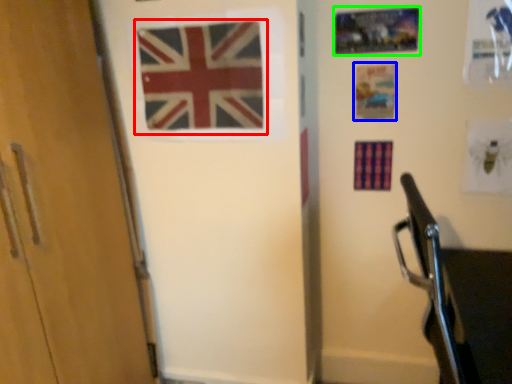
Question: Which object is the closest to the flag (highlighted by a red box)? Choose among these: postcard (highlighted by a blue box) or postcard (highlighted by a green box).

Choices:
 (A) postcard
 (B) postcard

Answer: (B)